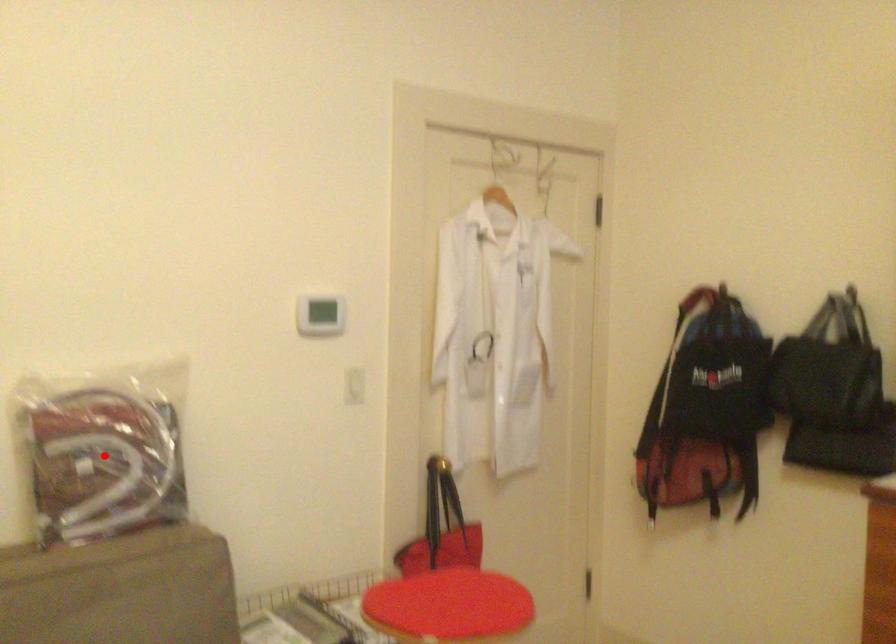
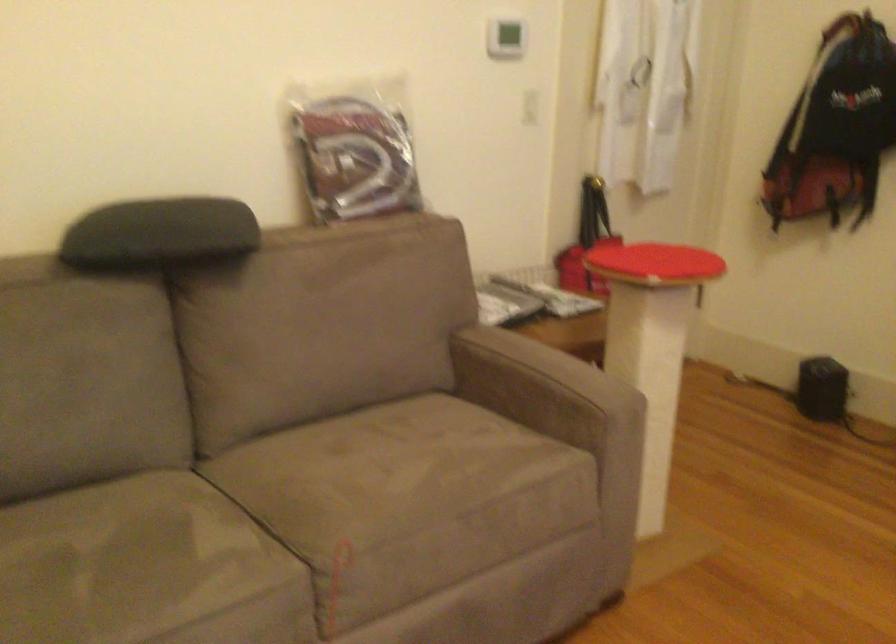
Where in the second image is the point corresponding to the highlighted location from the first image?

(354, 149)